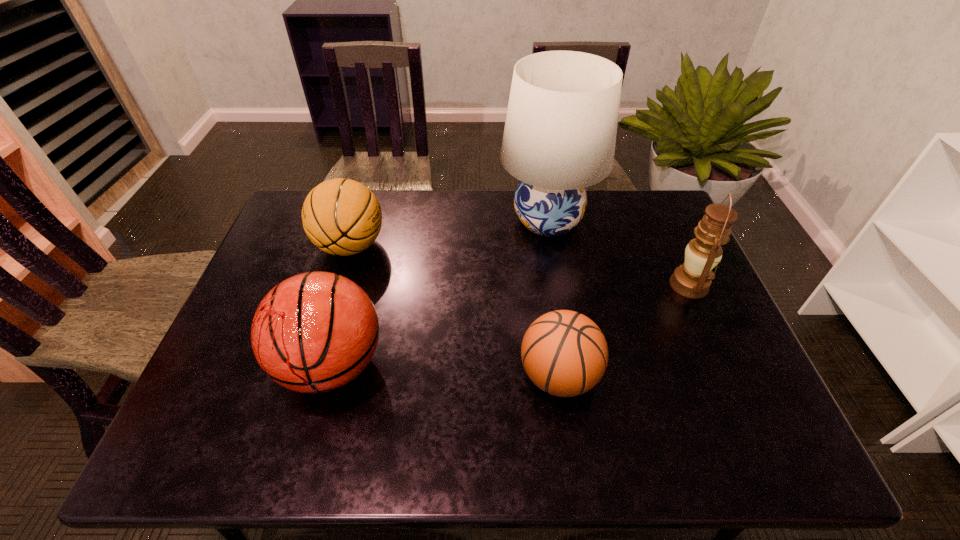
Locate an element on the screen. The width and height of the screenshot is (960, 540). vacant space at the left edge of the desktop is located at coordinates (250, 329).

Where is `vacant area at the right edge`? vacant area at the right edge is located at coordinates (678, 265).

At what (x,y) coordinates should I click in order to perform the action: click on vacant region between the oil lamp and the rightmost basketball. Please return your answer as a coordinate pair (x, y). The width and height of the screenshot is (960, 540). Looking at the image, I should click on (624, 330).

The height and width of the screenshot is (540, 960). I want to click on free space that is in between the rightmost basketball and the rightmost object, so click(x=624, y=330).

At what (x,y) coordinates should I click in order to perform the action: click on vacant area that lies between the rightmost object and the shortest object. Please return your answer as a coordinate pair (x, y). The height and width of the screenshot is (540, 960). Looking at the image, I should click on (624, 330).

Locate an element on the screen. Image resolution: width=960 pixels, height=540 pixels. free space between the tallest basketball and the tallest object is located at coordinates (440, 293).

The width and height of the screenshot is (960, 540). I want to click on free space between the second shortest object and the rightmost object, so click(520, 266).

This screenshot has width=960, height=540. Find the location of `free space between the tallest object and the rightmost object`. free space between the tallest object and the rightmost object is located at coordinates (618, 253).

You are a GUI agent. You are given a task and a screenshot of the screen. Output one action in this format:
    pyautogui.click(x=<x>, y=<y>)
    Task: Click on the vacant space that is in between the second tallest basketball and the tallest object
    The height and width of the screenshot is (540, 960).
    Given the screenshot: What is the action you would take?
    pyautogui.click(x=449, y=233)

Where is `free space between the second tallest basketball and the tallest object`? This screenshot has height=540, width=960. free space between the second tallest basketball and the tallest object is located at coordinates click(449, 233).